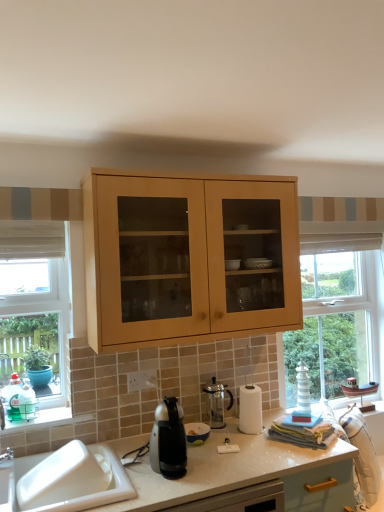
Question: In terms of height, does satin black coffee maker at center look taller or shorter compared to white glossy sink at lower left?

Choices:
 (A) tall
 (B) short

Answer: (A)

Question: Considering the positions of satin black coffee maker at center and white glossy sink at lower left in the image, is satin black coffee maker at center wider or thinner than white glossy sink at lower left?

Choices:
 (A) thin
 (B) wide

Answer: (A)

Question: Which is farther from the white glossy sink at lower left?

Choices:
 (A) matte black coffee maker at center, the second appliance viewed from the back
 (B) wooden window frame at left
 (C) clear glass coffee pot at center, which ranks as the first appliance in back-to-front order
 (D) satin black coffee maker at center

Answer: (C)

Question: Which object is positioned closest to the satin black coffee maker at center?

Choices:
 (A) wooden window frame at left
 (B) clear glass coffee pot at center, which ranks as the first appliance in back-to-front order
 (C) matte black coffee maker at center, arranged as the first appliance when viewed from the front
 (D) white glossy sink at lower left

Answer: (C)